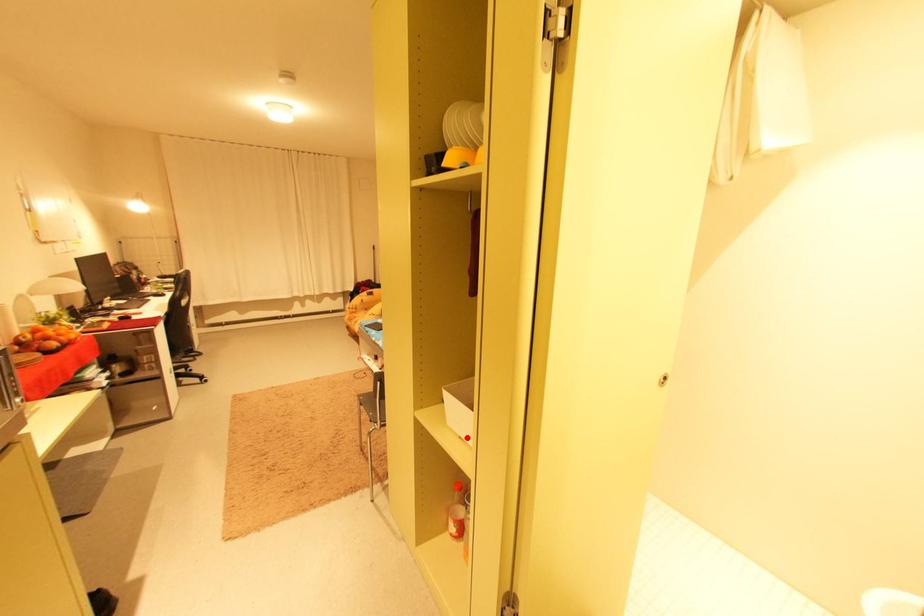
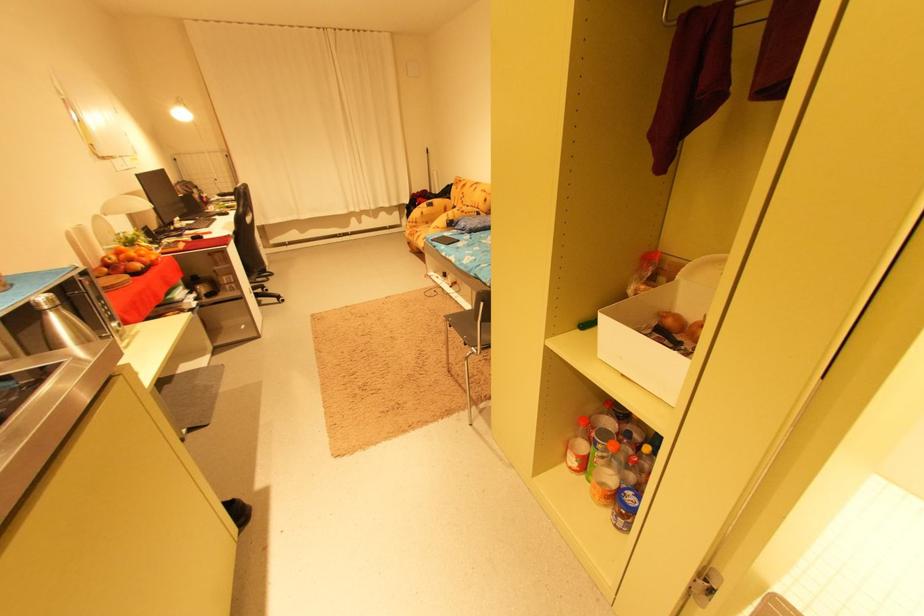
Find the pixel in the second image that matches the highlighted location in the first image.

(629, 376)